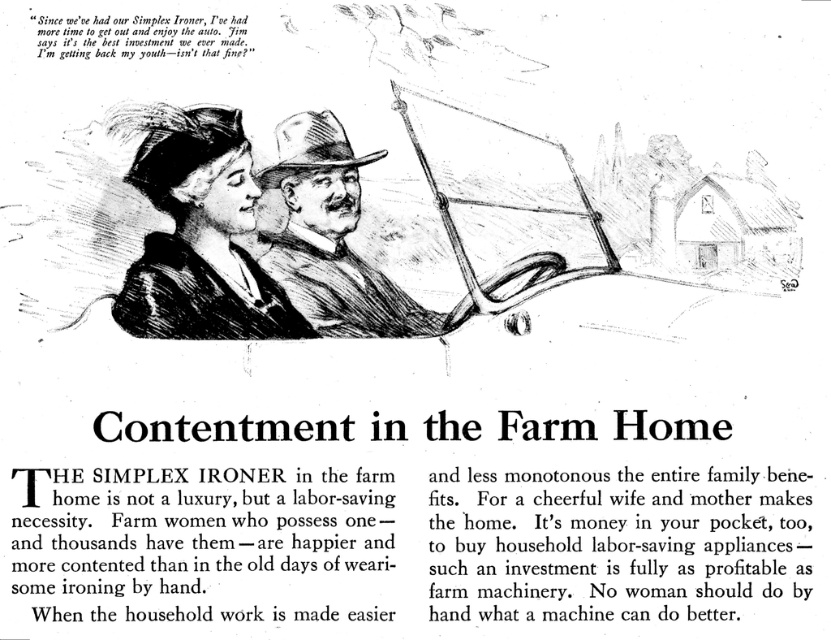
Question: Which object appears farthest from the camera in this image?

Choices:
 (A) brown textured hat at center
 (B) matte black dress at upper left

Answer: (A)

Question: Can you confirm if matte black dress at upper left is smaller than brown textured hat at center?

Choices:
 (A) yes
 (B) no

Answer: (B)

Question: Does matte black dress at upper left lie in front of brown textured hat at center?

Choices:
 (A) no
 (B) yes

Answer: (B)

Question: Which point appears closest to the camera in this image?

Choices:
 (A) (134, 120)
 (B) (343, 154)

Answer: (A)

Question: Does matte black dress at upper left have a lesser width compared to brown textured hat at center?

Choices:
 (A) yes
 (B) no

Answer: (B)

Question: Which object appears closest to the camera in this image?

Choices:
 (A) matte black dress at upper left
 (B) brown textured hat at center

Answer: (A)